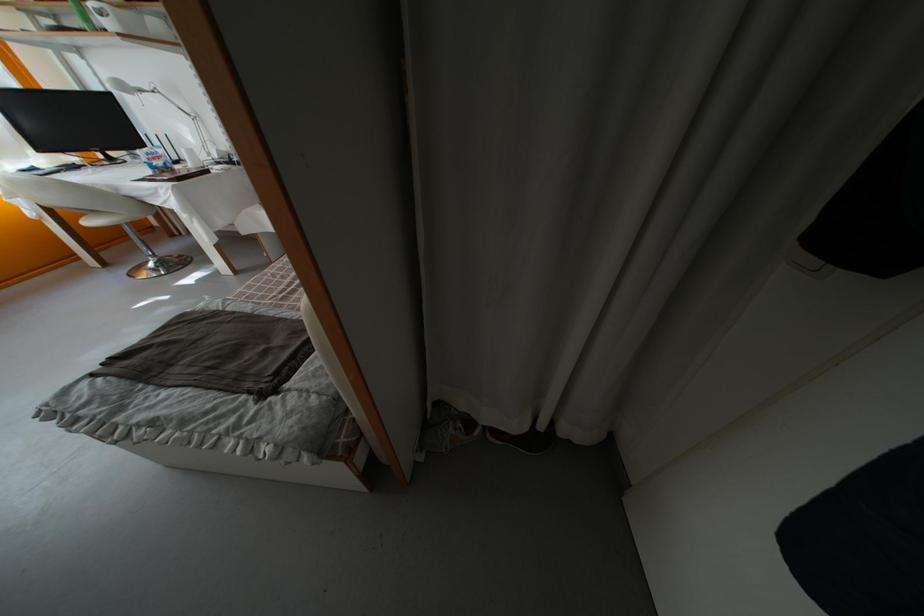
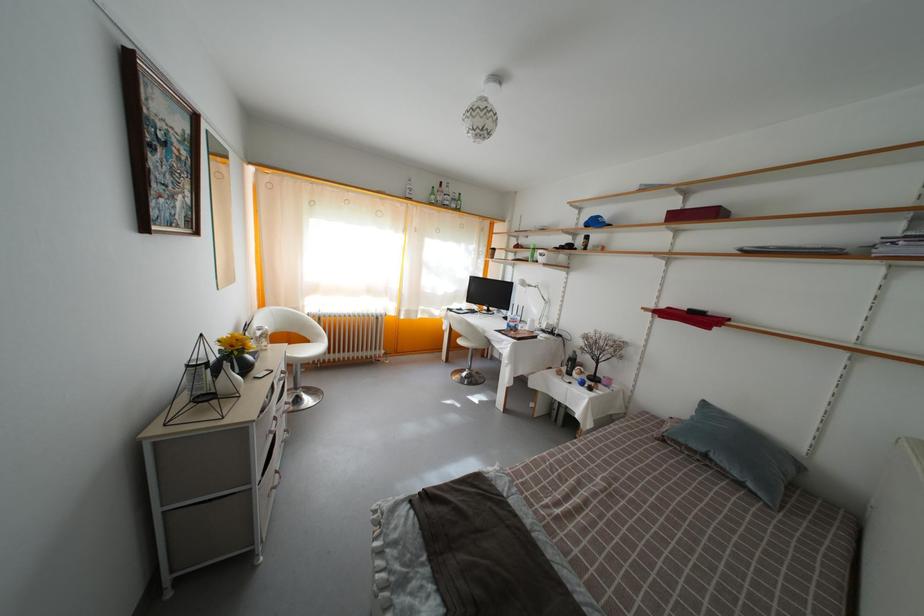
Question: The camera is either moving clockwise (left) or counter-clockwise (right) around the object. The first image is from the beginning of the video and the second image is from the end. Is the camera moving left or right when shooting the video?

Choices:
 (A) Left
 (B) Right

Answer: (B)